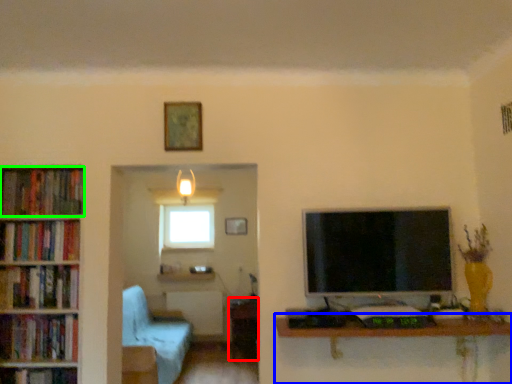
Question: Based on their relative distances, which object is farther from table (highlighted by a red box)? Choose from table (highlighted by a blue box) and book (highlighted by a green box).

Choices:
 (A) table
 (B) book

Answer: (B)